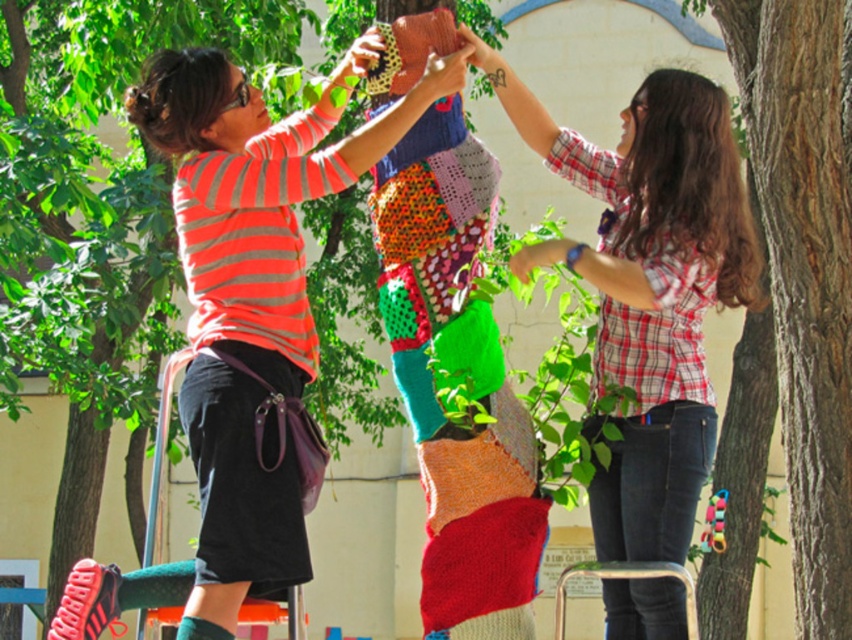
Between plaid shirt at upper right and rough bark tree at upper right, which one is positioned higher?

rough bark tree at upper right is higher up.

Which is behind, point (635, 292) or point (826, 413)?

Positioned behind is point (826, 413).

Where is `plaid shirt at upper right`? plaid shirt at upper right is located at coordinates (649, 285).

Is knitted fabric doll at center above plaid shirt at upper right?

Yes, knitted fabric doll at center is above plaid shirt at upper right.

Who is more distant from viewer, (262, 227) or (697, 346)?

Point (697, 346)

Is point (304, 346) positioned behind point (630, 452)?

No, it is not.

The image size is (852, 640). I want to click on knitted fabric doll at center, so click(252, 300).

Which is more to the left, knitted fabric doll at center or rough bark tree at upper right?

From the viewer's perspective, knitted fabric doll at center appears more on the left side.

Which is more to the right, knitted fabric doll at center or rough bark tree at upper right?

rough bark tree at upper right is more to the right.

Who is more forward, (298, 285) or (801, 92)?

Point (298, 285)

At what (x,y) coordinates should I click in order to perform the action: click on knitted fabric doll at center. Please return your answer as a coordinate pair (x, y). Looking at the image, I should click on (252, 300).